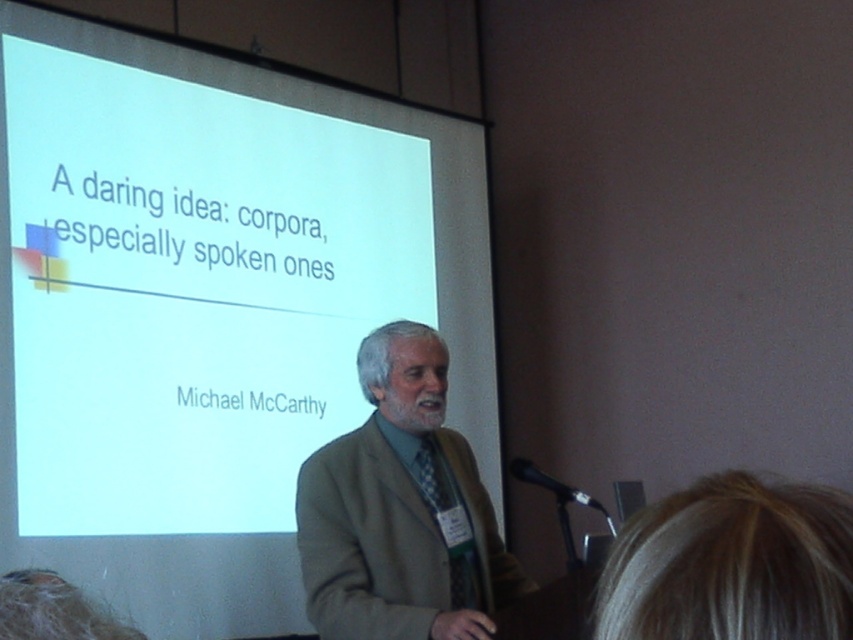
Is beige woolen jacket at center shorter than black plastic microphone at lower right?

Incorrect, beige woolen jacket at center's height does not fall short of black plastic microphone at lower right's.

Can you confirm if beige woolen jacket at center is wider than black plastic microphone at lower right?

Yes.

Between point (399, 461) and point (518, 460), which one is positioned in front?

Point (399, 461)

Identify the location of beige woolen jacket at center. (401, 509).

Between point (294, 333) and point (421, 570), which one is positioned behind?

The point (294, 333) is behind.

The height and width of the screenshot is (640, 853). In order to click on white matte projection screen at upper center in this screenshot , I will do `click(190, 291)`.

This screenshot has width=853, height=640. Find the location of `white matte projection screen at upper center`. white matte projection screen at upper center is located at coordinates (190, 291).

Can you confirm if white matte projection screen at upper center is smaller than black plastic microphone at lower right?

No.

Image resolution: width=853 pixels, height=640 pixels. I want to click on white matte projection screen at upper center, so tap(190, 291).